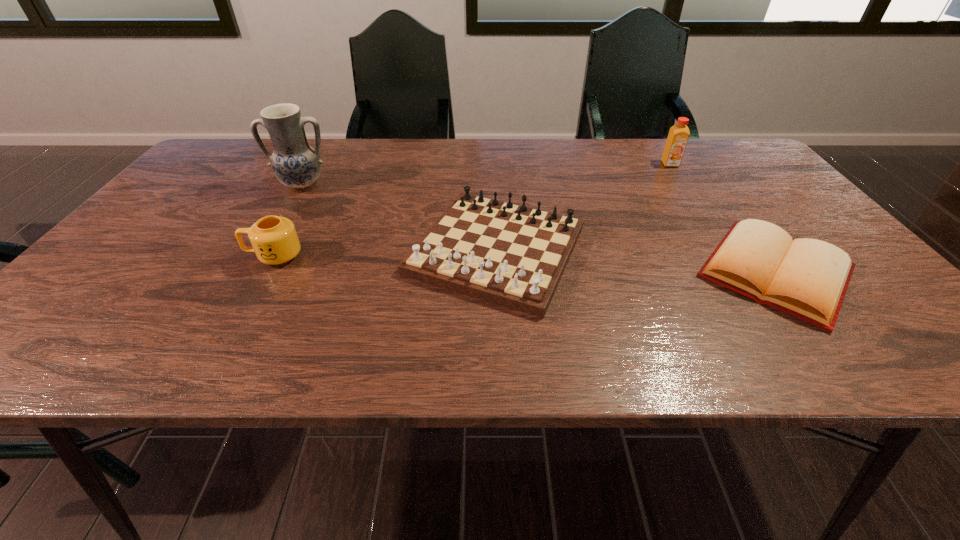
The height and width of the screenshot is (540, 960). Find the location of `free space at the far edge`. free space at the far edge is located at coordinates (335, 170).

This screenshot has width=960, height=540. I want to click on vacant space at the near edge of the desktop, so click(x=172, y=348).

In the image, there is a desktop. Identify the location of vacant space at the left edge. This screenshot has width=960, height=540. (121, 324).

This screenshot has height=540, width=960. Find the location of `vacant region at the right edge of the desktop`. vacant region at the right edge of the desktop is located at coordinates pyautogui.click(x=724, y=178).

This screenshot has width=960, height=540. I want to click on vacant area that lies between the fourth shortest object and the fourth nearest object, so click(x=487, y=174).

The image size is (960, 540). Identify the location of empty location between the third object from left to right and the mug. (385, 253).

The image size is (960, 540). Find the location of `vacant area that lies between the shortest object and the third object from left to right`. vacant area that lies between the shortest object and the third object from left to right is located at coordinates (636, 261).

The height and width of the screenshot is (540, 960). I want to click on blank region between the third object from left to right and the Bible, so click(636, 261).

Locate an element on the screen. empty space between the fourth tallest object and the shortest object is located at coordinates (636, 261).

Locate an element on the screen. The width and height of the screenshot is (960, 540). object that ranks as the closest to the fourth nearest object is located at coordinates (274, 239).